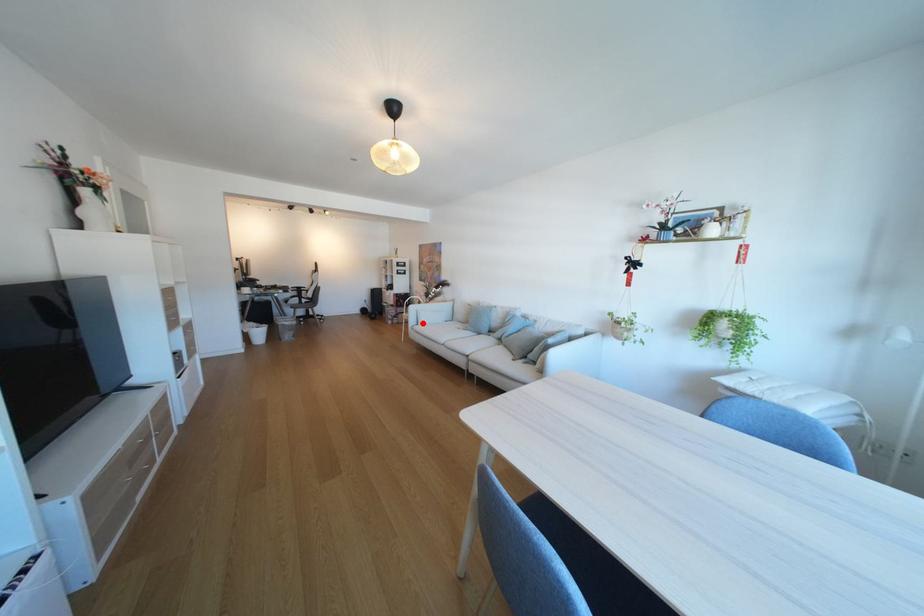
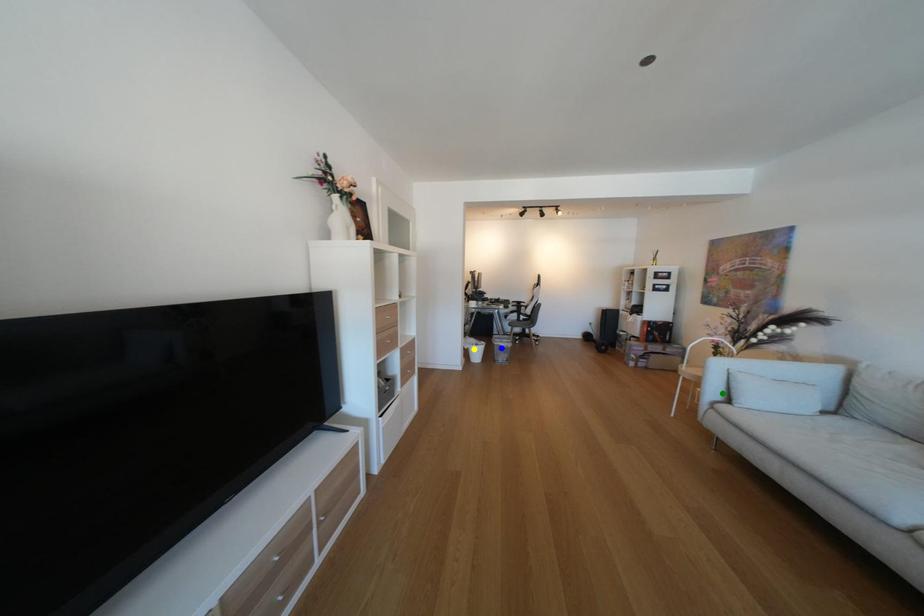
Question: I am providing you with two images of the same scene from different viewpoints. A red point is marked on the first image. You are given multiple points on the second image. In image 2, which mark is for the same physical point as the one in image 1?

Choices:
 (A) blue point
 (B) green point
 (C) yellow point

Answer: (B)